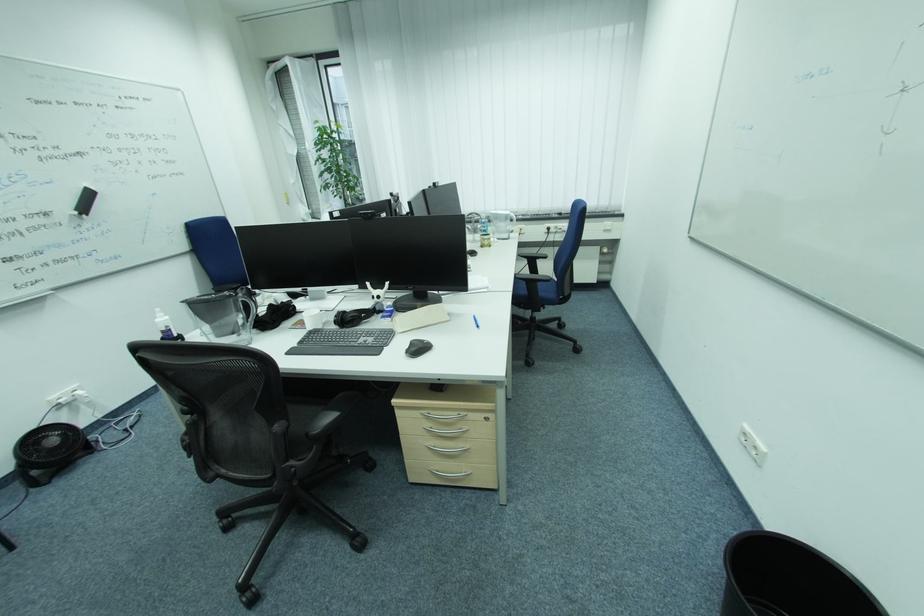
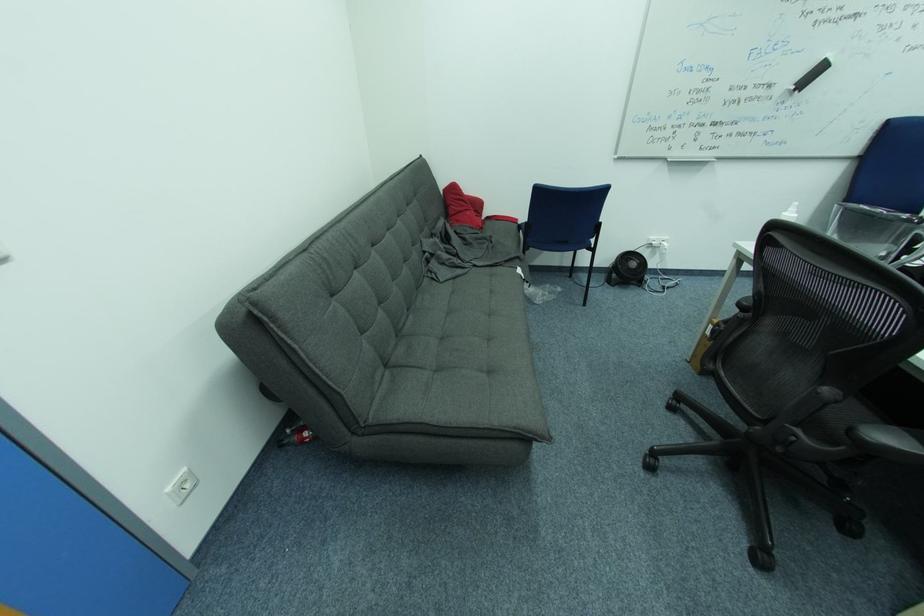
Locate, in the second image, the point that corresponds to point 40,490 in the first image.

(613, 285)